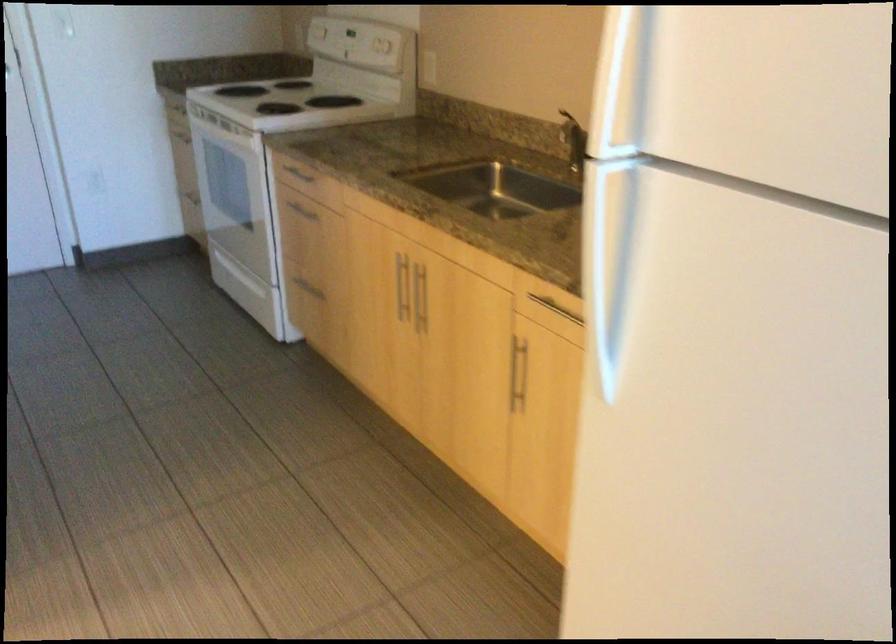
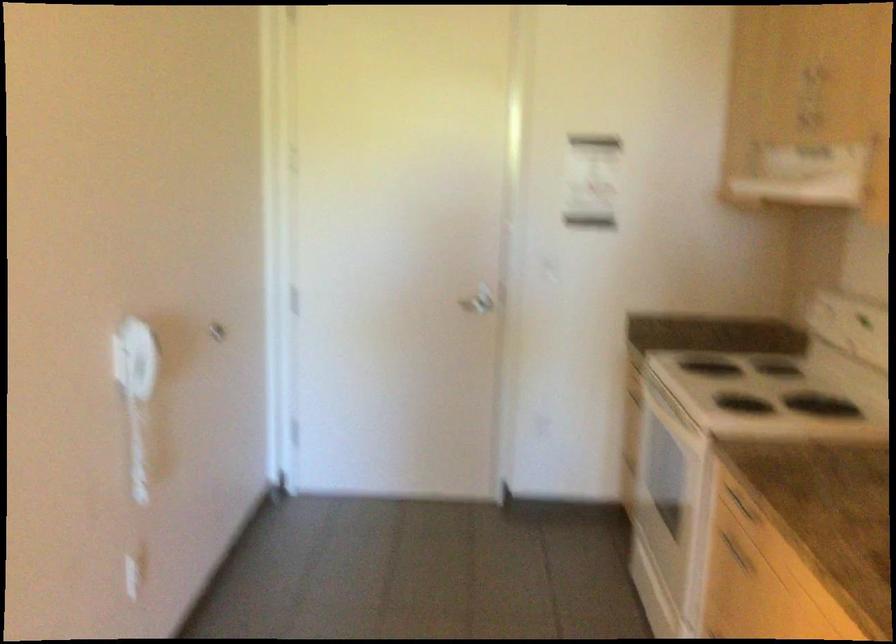
Question: The camera is either moving clockwise (left) or counter-clockwise (right) around the object. The first image is from the beginning of the video and the second image is from the end. Is the camera moving left or right when shooting the video?

Choices:
 (A) Left
 (B) Right

Answer: (B)